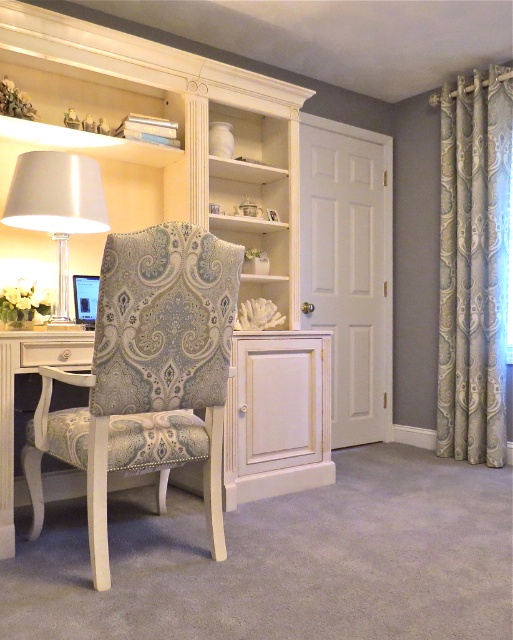
You are moving a small box from the desk to the floor. The box is placed between the patterned fabric swivel chair at left and the satin silver lampshade at left. Since the box is only 15 cm wide, will it fit between them?

The patterned fabric swivel chair at left is larger than the satin silver lampshade at left, so there is enough space for the 15 cm wide box to fit between them.

You are standing at point (147, 374) in the home office. What object is located at this point?

The patterned fabric swivel chair at left is located at point (147, 374).

You are a delivery person who needs to place a package between the patterned fabric swivel chair at left and the satin silver lampshade at left. The package is 28 inches long. Can you fit it between them?

The distance between the patterned fabric swivel chair at left and the satin silver lampshade at left is 28.79 inches. Since the package is 28 inches long, it can fit between them with a small amount of space remaining.